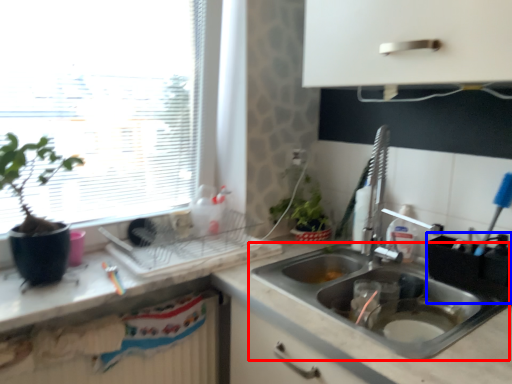
Question: Which object appears closest to the camera in this image, sink (highlighted by a red box) or appliance (highlighted by a blue box)?

Choices:
 (A) sink
 (B) appliance

Answer: (A)